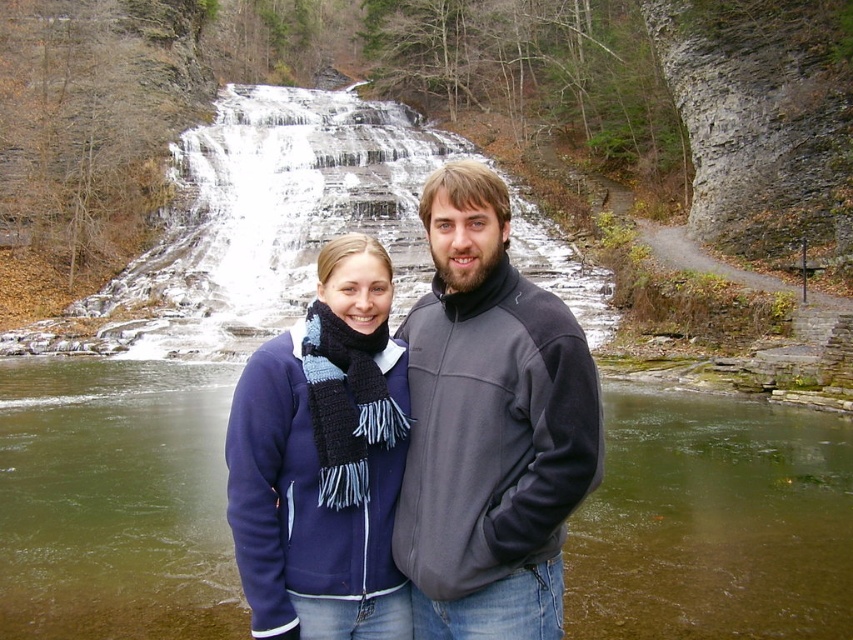
You are a photographer standing in front of the waterfall. You want to take a photo that includes both the green water at center and the blue knitted scarf at center. Which object should you focus on first to ensure both are in clear view?

The green water at center is further to the viewer than the blue knitted scarf at center, so you should focus on the green water at center first to ensure both are in clear view.